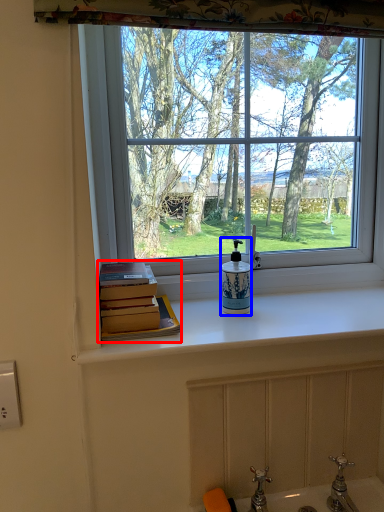
Question: Which object appears farthest to the camera in this image, book (highlighted by a red box) or soap dispenser (highlighted by a blue box)?

Choices:
 (A) book
 (B) soap dispenser

Answer: (B)